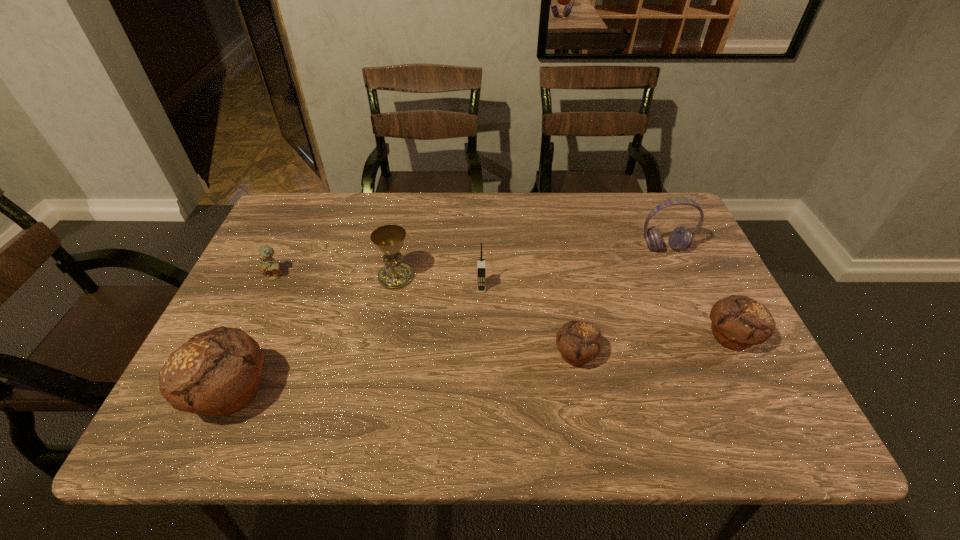
You are a GUI agent. You are given a task and a screenshot of the screen. Output one action in this format:
    pyautogui.click(x=<x>, y=<y>)
    Task: Click on the vacant space that is in between the teddy bear and the leftmost muffin
    The image size is (960, 540).
    Given the screenshot: What is the action you would take?
    pyautogui.click(x=252, y=334)

Locate an element on the screen. The height and width of the screenshot is (540, 960). unoccupied area between the rightmost muffin and the tallest muffin is located at coordinates (481, 365).

Identify the location of vacant space that is in between the second tallest muffin and the teddy bear. The height and width of the screenshot is (540, 960). (503, 306).

At what (x,y) coordinates should I click in order to perform the action: click on object that is the nearest to the fourth object from right to left. Please return your answer as a coordinate pair (x, y). Looking at the image, I should click on (389, 239).

Identify the location of object that is the fifth nearest to the fifth object from left to right. The height and width of the screenshot is (540, 960). (216, 373).

Identify which muffin is the second nearest to the leftmost muffin. Please provide its 2D coordinates. Your answer should be formatted as a tuple, i.e. [(x, y)], where the tuple contains the x and y coordinates of a point satisfying the conditions above.

[(738, 322)]

Select which muffin is the second closest to the third object from left to right. Please provide its 2D coordinates. Your answer should be formatted as a tuple, i.e. [(x, y)], where the tuple contains the x and y coordinates of a point satisfying the conditions above.

[(579, 342)]

At what (x,y) coordinates should I click in order to perform the action: click on vacant region that satisfies the following two spatial constraints: 1. on the front-facing side of the cellular telephone; 2. on the right side of the fifth object from left to right. Please return your answer as a coordinate pair (x, y). This screenshot has width=960, height=540. Looking at the image, I should click on (482, 354).

Identify the location of vacant space that satisfies the following two spatial constraints: 1. on the headband and ear cups of the farthest object; 2. on the left side of the second tallest muffin. (704, 337).

Image resolution: width=960 pixels, height=540 pixels. Identify the location of free space in the image that satisfies the following two spatial constraints: 1. on the front-facing side of the chalice; 2. on the right side of the teddy bear. (274, 278).